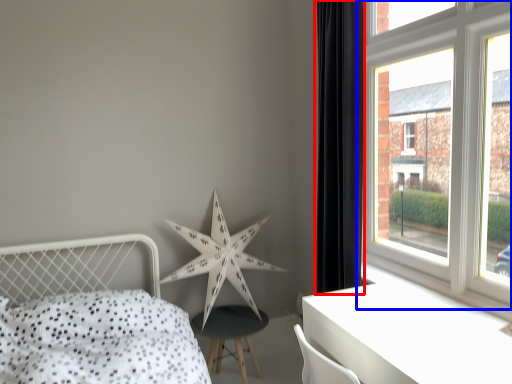
Question: Which object appears farthest to the camera in this image, curtain (highlighted by a red box) or window (highlighted by a blue box)?

Choices:
 (A) curtain
 (B) window

Answer: (A)